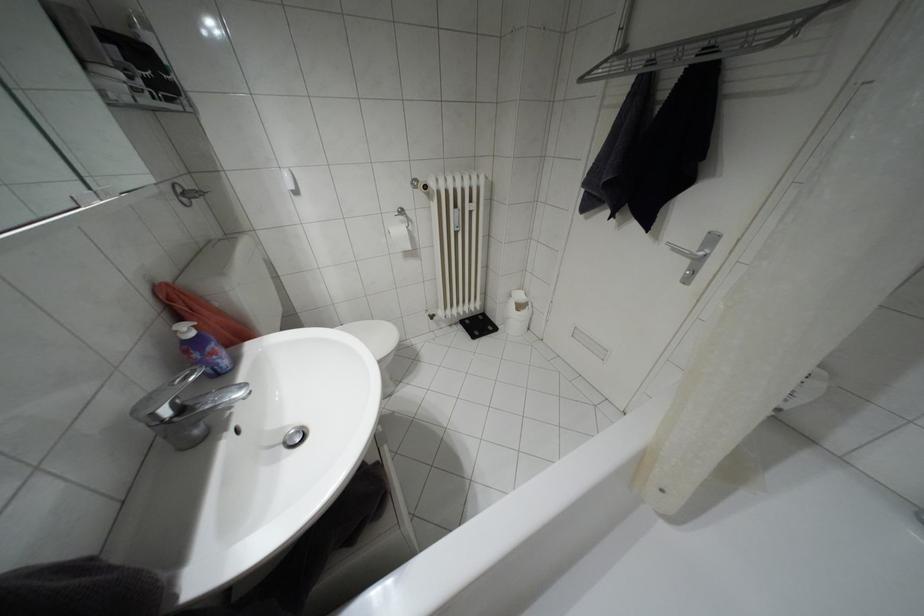
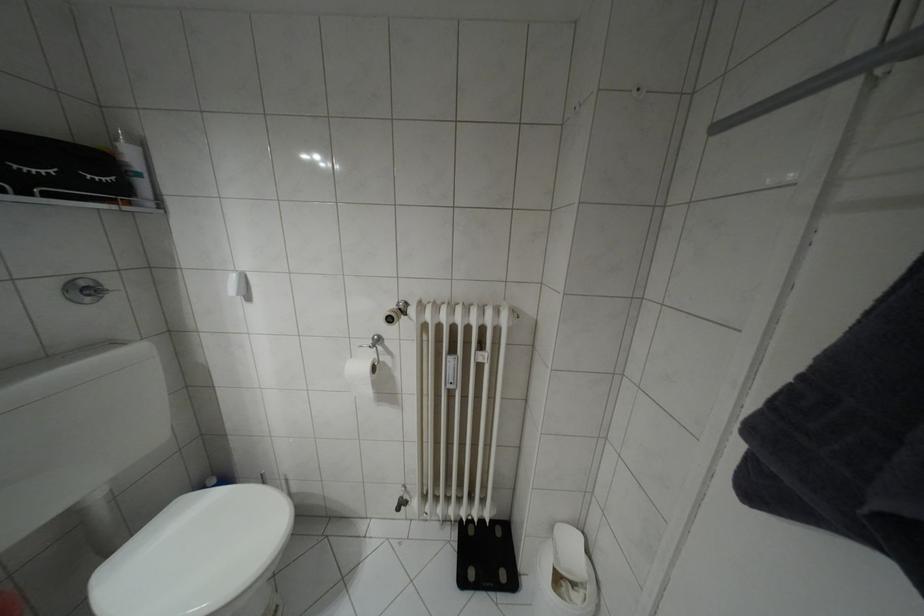
Where in the second image is the point corresponding to pixel 177 188 from the first image?

(81, 284)